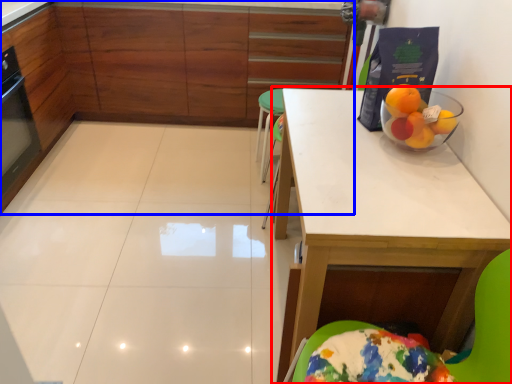
Question: Which object is further to the camera taking this photo, table (highlighted by a red box) or cabinetry (highlighted by a blue box)?

Choices:
 (A) table
 (B) cabinetry

Answer: (B)